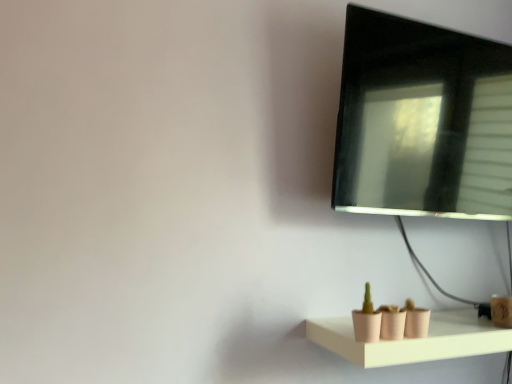
Question: Considering the relative sizes of black glossy monitor at upper right and matte pink shelf at lower right in the image provided, is black glossy monitor at upper right wider than matte pink shelf at lower right?

Choices:
 (A) no
 (B) yes

Answer: (A)

Question: Is black glossy monitor at upper right positioned behind matte pink shelf at lower right?

Choices:
 (A) no
 (B) yes

Answer: (B)

Question: Could matte pink shelf at lower right be considered to be inside black glossy monitor at upper right?

Choices:
 (A) no
 (B) yes

Answer: (A)

Question: Does black glossy monitor at upper right appear on the left side of matte pink shelf at lower right?

Choices:
 (A) yes
 (B) no

Answer: (B)

Question: Is black glossy monitor at upper right to the right of matte pink shelf at lower right from the viewer's perspective?

Choices:
 (A) no
 (B) yes

Answer: (B)

Question: Can you confirm if black glossy monitor at upper right is taller than matte pink shelf at lower right?

Choices:
 (A) yes
 (B) no

Answer: (A)

Question: Is matte pink shelf at lower right outside of black glossy monitor at upper right?

Choices:
 (A) no
 (B) yes

Answer: (B)

Question: Does matte pink shelf at lower right have a greater height compared to black glossy monitor at upper right?

Choices:
 (A) no
 (B) yes

Answer: (A)

Question: From the image's perspective, is matte pink shelf at lower right below black glossy monitor at upper right?

Choices:
 (A) yes
 (B) no

Answer: (A)

Question: Is matte pink shelf at lower right turned away from black glossy monitor at upper right?

Choices:
 (A) yes
 (B) no

Answer: (B)

Question: Considering the relative sizes of matte pink shelf at lower right and black glossy monitor at upper right in the image provided, is matte pink shelf at lower right thinner than black glossy monitor at upper right?

Choices:
 (A) yes
 (B) no

Answer: (B)

Question: Considering the relative sizes of matte pink shelf at lower right and black glossy monitor at upper right in the image provided, is matte pink shelf at lower right bigger than black glossy monitor at upper right?

Choices:
 (A) yes
 (B) no

Answer: (B)

Question: From their relative heights in the image, would you say black glossy monitor at upper right is taller or shorter than matte pink shelf at lower right?

Choices:
 (A) tall
 (B) short

Answer: (A)